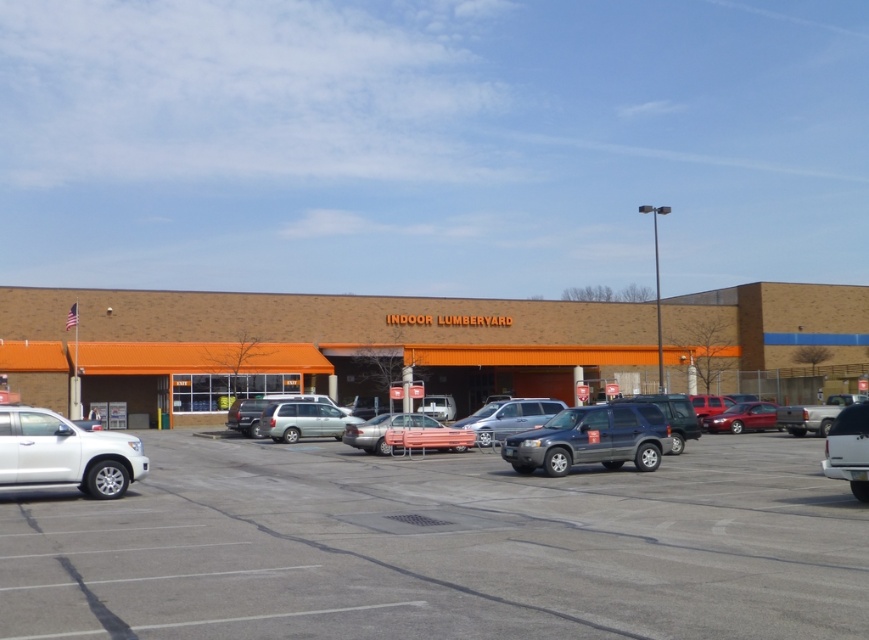
You are a delivery driver trying to park your truck, which is 2 meters wide, in the parking lot. You see the white matte truck at lower right and the satin silver suv at center. Can your truck fit in the space between them?

The white matte truck at lower right is thinner than the satin silver suv at center, so the space between them may be narrower than the width of your truck. It is recommended to choose a different parking spot to ensure safety and avoid damage.